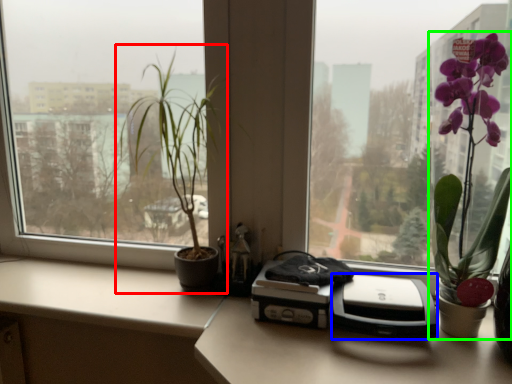
Question: Considering the real-world distances, which object is closest to houseplant (highlighted by a red box)? printer (highlighted by a blue box) or houseplant (highlighted by a green box).

Choices:
 (A) printer
 (B) houseplant

Answer: (A)